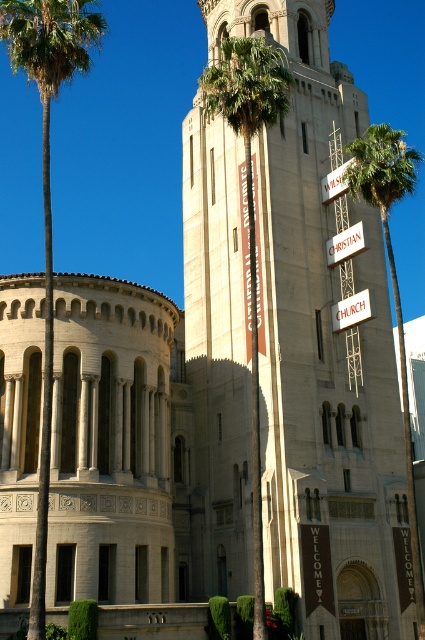
Question: Can you confirm if green leafy palm tree at left is positioned below green leafy palm tree at center?

Choices:
 (A) yes
 (B) no

Answer: (B)

Question: Which of the following is the farthest from the observer?

Choices:
 (A) green leafy palm tree at center
 (B) green leafy palm tree at left

Answer: (A)

Question: Which point is closer to the camera?

Choices:
 (A) (57, 88)
 (B) (249, 109)

Answer: (A)

Question: Is the position of green leafy palm tree at left more distant than that of green leafy palm tree at center?

Choices:
 (A) no
 (B) yes

Answer: (A)

Question: Does green leafy palm tree at left appear under green leafy palm tree at center?

Choices:
 (A) no
 (B) yes

Answer: (A)

Question: Among these objects, which one is farthest from the camera?

Choices:
 (A) green leafy palm tree at center
 (B) green leafy palm tree at left

Answer: (A)